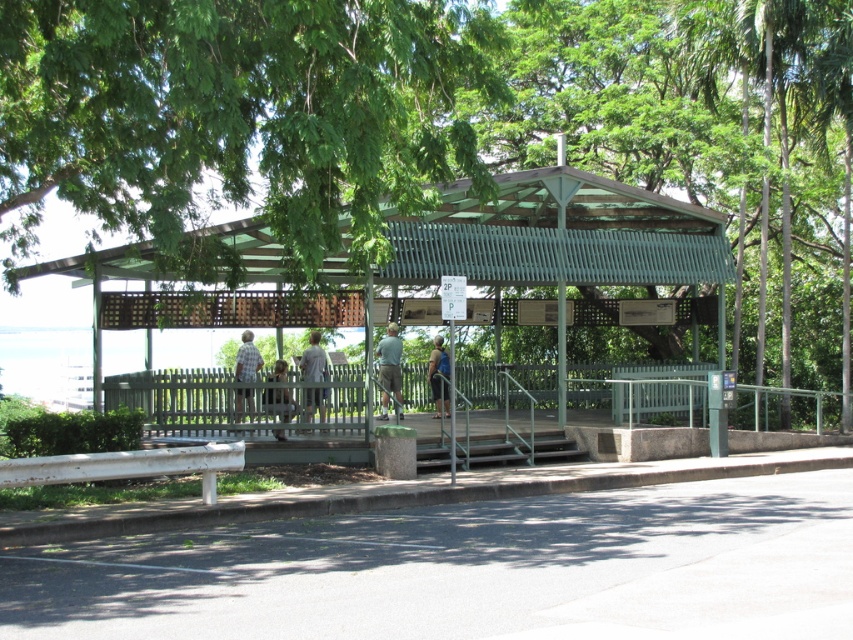
You are a visitor at the park and want to sit on the white painted metal park bench at lower left. To reach it, you need to walk around the light brown wooden fence at center. Which direction should you walk to get to the bench from the fence?

The white painted metal park bench at lower left is positioned on the left side of the light brown wooden fence at center. Therefore, to reach the bench from the fence, you should walk to the left.